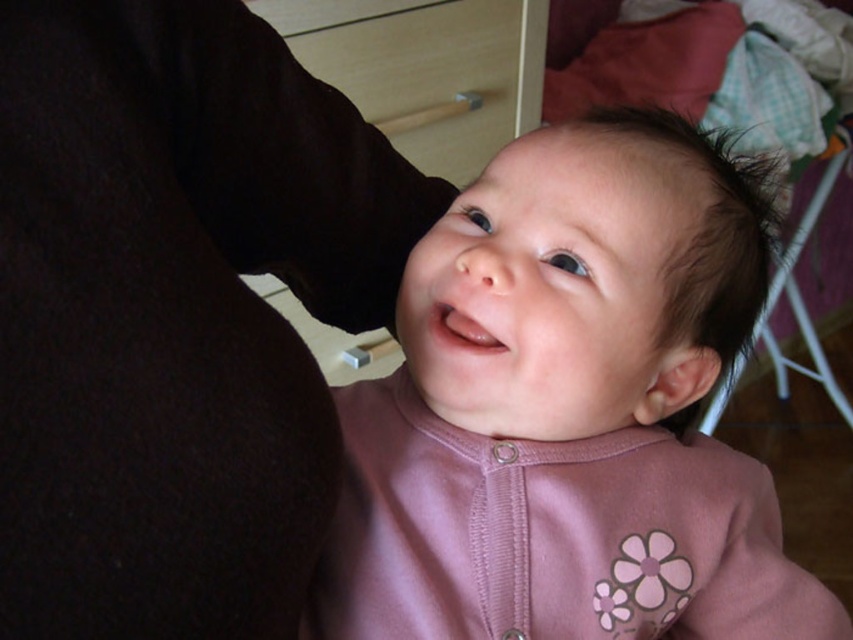
Question: Does pink fabric baby at center appear on the left side of dark brown silky hair at upper right?

Choices:
 (A) no
 (B) yes

Answer: (B)

Question: Can you confirm if pink fabric baby at center is positioned above dark brown silky hair at upper right?

Choices:
 (A) no
 (B) yes

Answer: (A)

Question: Is pink fabric baby at center positioned at the back of dark brown silky hair at upper right?

Choices:
 (A) no
 (B) yes

Answer: (A)